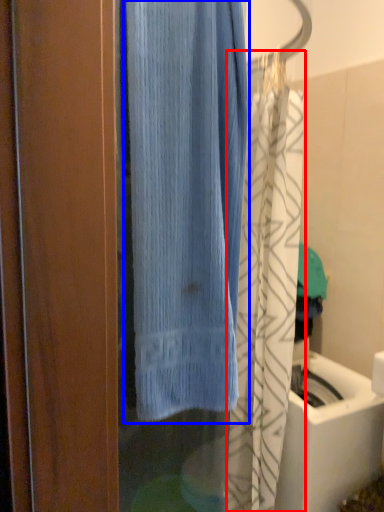
Question: Which object appears closest to the camera in this image, shower curtain (highlighted by a red box) or curtain (highlighted by a blue box)?

Choices:
 (A) shower curtain
 (B) curtain

Answer: (B)